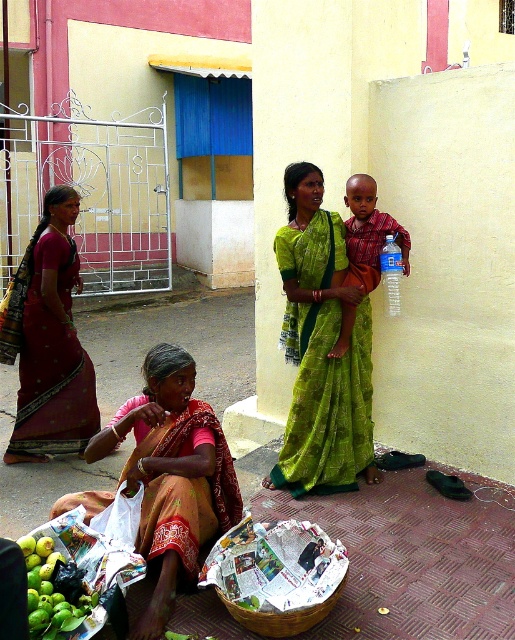
Question: Is lime green fruit at lower left to the right of matte red shirt at center from the viewer's perspective?

Choices:
 (A) no
 (B) yes

Answer: (A)

Question: Which point appears closest to the camera in this image?

Choices:
 (A) (306, 182)
 (B) (349, 179)
 (C) (60, 314)

Answer: (A)

Question: Which is farther from the woven brown basket at lower center?

Choices:
 (A) lime green fruit at lower left
 (B) matte orange saree at lower left
 (C) pink tile pavement at lower center
 (D) maroon silk saree at left

Answer: (D)

Question: Which is farther from the green silk saree at center?

Choices:
 (A) matte orange saree at lower left
 (B) matte red shirt at center
 (C) pink tile pavement at lower center

Answer: (C)

Question: Considering the relative positions of green silk saree at center and maroon silk saree at left in the image provided, where is green silk saree at center located with respect to maroon silk saree at left?

Choices:
 (A) left
 (B) right

Answer: (B)

Question: Is green silk saree at center above matte red shirt at center?

Choices:
 (A) no
 (B) yes

Answer: (A)